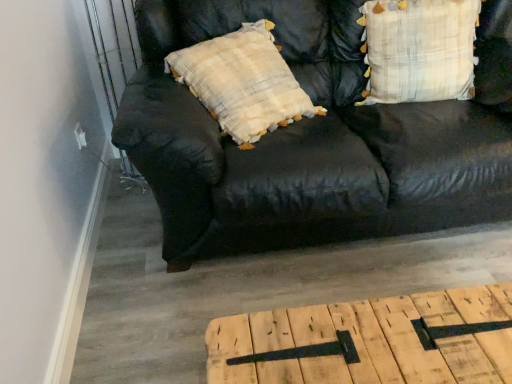
In order to face plaid fabric pillow at upper right, should I rotate leftwards or rightwards?

It's best to rotate right around 21.488 degrees.

Find the location of a particular element. black leather couch at center is located at coordinates (314, 137).

In order to face black leather couch at center, should I rotate leftwards or rightwards?

You should look right and rotate roughly 11.955 degrees.

Locate an element on the screen. The width and height of the screenshot is (512, 384). light brown wood table at lower center is located at coordinates (370, 341).

Does light brown wood table at lower center appear on the right side of black leather couch at center?

No, light brown wood table at lower center is not to the right of black leather couch at center.

Is black leather couch at center a part of light brown wood table at lower center?

No, black leather couch at center is not surrounded by light brown wood table at lower center.

Is light brown wood table at lower center facing away from black leather couch at center?

That's not correct — light brown wood table at lower center is not looking away from black leather couch at center.

Based on the photo, can you tell me how much light brown wood table at lower center and plaid fabric pillow at upper right differ in facing direction?

The angular difference between light brown wood table at lower center and plaid fabric pillow at upper right is 94.1 degrees.

Between light brown wood table at lower center and plaid fabric pillow at upper right, which one has less height?

With less height is light brown wood table at lower center.

Can you confirm if light brown wood table at lower center is thinner than plaid fabric pillow at upper right?

Incorrect, the width of light brown wood table at lower center is not less than that of plaid fabric pillow at upper right.

In the image, is light brown wood table at lower center on the left side or the right side of plaid fabric pillow at upper right?

Based on their positions, light brown wood table at lower center is located to the left of plaid fabric pillow at upper right.

Considering the relative positions of plaid fabric pillow at upper right and light brown wood table at lower center in the image provided, is plaid fabric pillow at upper right to the right of light brown wood table at lower center from the viewer's perspective?

Indeed, plaid fabric pillow at upper right is positioned on the right side of light brown wood table at lower center.

Is plaid fabric pillow at upper right taller than light brown wood table at lower center?

Yes.

What's the angular difference between plaid fabric pillow at upper right and light brown wood table at lower center's facing directions?

plaid fabric pillow at upper right and light brown wood table at lower center are facing 94.1 degrees away from each other.

Is plaid fabric pillow at upper right placed right next to light brown wood table at lower center?

They are not placed beside each other.

Is plaid fabric pillow at upper right in contact with black leather couch at center?

They are not placed beside each other.

From a real-world perspective, is plaid fabric pillow at upper right physically located above or below black leather couch at center?

From a real-world perspective, plaid fabric pillow at upper right is physically above black leather couch at center.

Which point is more forward, (369, 59) or (482, 161)?

The point (482, 161) is in front.

Is black leather couch at center at the right side of plaid fabric pillow at upper right?

No, black leather couch at center is not to the right of plaid fabric pillow at upper right.

Is black leather couch at center facing towards plaid fabric pillow at upper right?

Yes.

Can you confirm if black leather couch at center is bigger than plaid fabric pillow at upper right?

Yes.

Between black leather couch at center and plaid fabric pillow at upper right, which one has less height?

With less height is plaid fabric pillow at upper right.

From the picture: Visually, is black leather couch at center positioned to the left or to the right of light brown wood table at lower center?

black leather couch at center is positioned on light brown wood table at lower center's right side.

Based on the photo, from a real-world perspective, is black leather couch at center on top of light brown wood table at lower center?

Yes, from a real-world perspective, black leather couch at center is over light brown wood table at lower center

Considering their positions, is black leather couch at center located in front of or behind light brown wood table at lower center?

In the image, black leather couch at center appears behind light brown wood table at lower center.

The image size is (512, 384). Identify the location of table that appears in front of the black leather couch at center. (370, 341).

This screenshot has width=512, height=384. What are the coordinates of `pillow above the light brown wood table at lower center (from the image's perspective)` in the screenshot? It's located at (419, 49).

Which object lies nearer to the anchor point plaid fabric pillow at upper right, light brown wood table at lower center or black leather couch at center?

black leather couch at center.

Considering their positions, is light brown wood table at lower center positioned closer to black leather couch at center than plaid fabric pillow at upper right?

Based on the image, plaid fabric pillow at upper right appears to be nearer to black leather couch at center.

When comparing their distances from light brown wood table at lower center, does black leather couch at center or plaid fabric pillow at upper right seem further?

Based on the image, plaid fabric pillow at upper right appears to be further to light brown wood table at lower center.

Which object lies further to the anchor point plaid fabric pillow at upper right, black leather couch at center or light brown wood table at lower center?

Based on the image, light brown wood table at lower center appears to be further to plaid fabric pillow at upper right.

Which object lies nearer to the anchor point light brown wood table at lower center, plaid fabric pillow at upper right or black leather couch at center?

Among the two, black leather couch at center is located nearer to light brown wood table at lower center.

Considering their positions, is plaid fabric pillow at upper right positioned closer to black leather couch at center than light brown wood table at lower center?

Among the two, plaid fabric pillow at upper right is located nearer to black leather couch at center.

The height and width of the screenshot is (384, 512). Identify the location of studio couch that lies between plaid fabric pillow at upper right and light brown wood table at lower center from top to bottom. (314, 137).